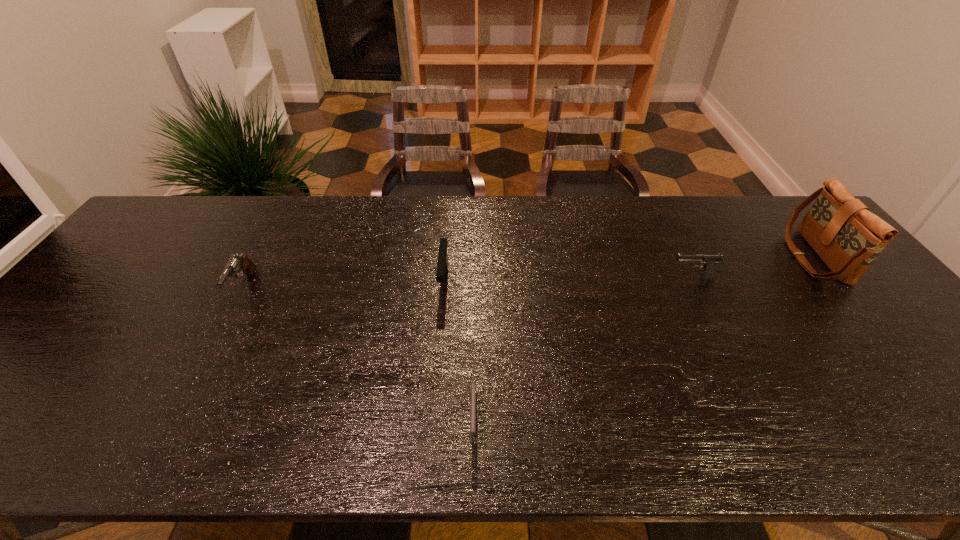
You are a GUI agent. You are given a task and a screenshot of the screen. Output one action in this format:
    pyautogui.click(x=<x>, y=<y>)
    Task: Click on the free spot between the leftmost pistol and the second pistol from left to right
    This screenshot has width=960, height=540.
    Given the screenshot: What is the action you would take?
    pyautogui.click(x=344, y=285)

Where is `vacant space that's between the leftmost pistol and the rightmost object`? vacant space that's between the leftmost pistol and the rightmost object is located at coordinates [529, 272].

The width and height of the screenshot is (960, 540). What are the coordinates of `vacant area that lies between the leftmost object and the third object from left to right` in the screenshot? It's located at (359, 354).

In order to click on blank region between the leftmost pistol and the third object from right to left in this screenshot , I will do `click(359, 354)`.

Identify the location of object that is the fourth closest one to the rightmost pistol. The height and width of the screenshot is (540, 960). click(236, 263).

Locate an element on the screen. This screenshot has width=960, height=540. object that stands as the closest to the tallest object is located at coordinates (710, 260).

Identify which pistol is the closest to the rightmost pistol. Please provide its 2D coordinates. Your answer should be formatted as a tuple, i.e. [(x, y)], where the tuple contains the x and y coordinates of a point satisfying the conditions above.

[(442, 265)]

Find the location of a particular element. This screenshot has height=540, width=960. pistol that is the closest to the leftmost pistol is located at coordinates click(x=442, y=265).

Identify the location of free space that satisfies the following two spatial constraints: 1. aim along the barrel of the second object from right to left; 2. at the barrel of the leftmost pistol. (696, 287).

The height and width of the screenshot is (540, 960). I want to click on vacant space that satisfies the following two spatial constraints: 1. aim along the barrel of the rightmost pistol; 2. at the barrel of the third object from left to right, so click(x=763, y=422).